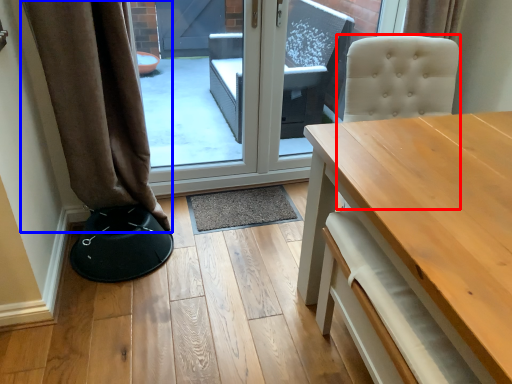
Question: Which of the following is the farthest to the observer, swivel chair (highlighted by a red box) or curtain (highlighted by a blue box)?

Choices:
 (A) swivel chair
 (B) curtain

Answer: (B)